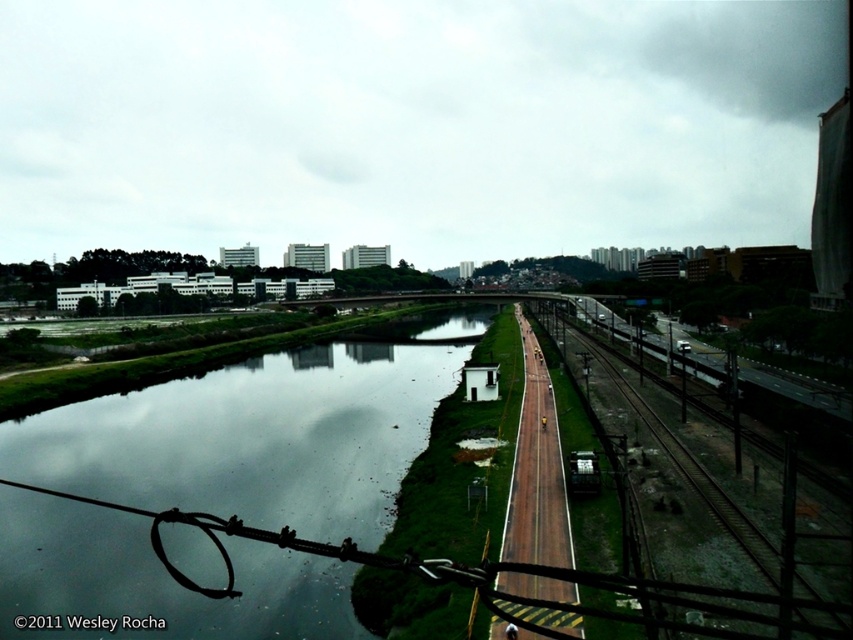
You are a photographer trying to capture the brown wooden train track at center and the reflective glass water at center in the same frame. Based on their positions, which object appears closer to the camera?

The brown wooden train track at center appears closer to the camera because it is taller than the reflective glass water at center, which is not as tall.